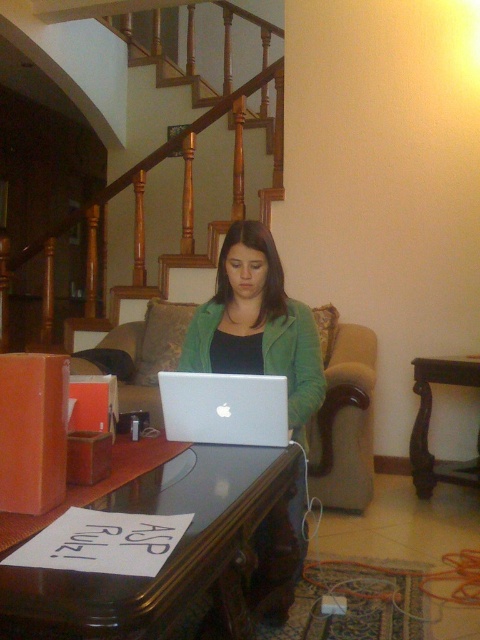
Image resolution: width=480 pixels, height=640 pixels. In order to click on black glossy table at lower center in this screenshot , I will do `click(168, 556)`.

Does black glossy table at lower center have a larger size compared to silver metallic laptop at center?

Indeed, black glossy table at lower center has a larger size compared to silver metallic laptop at center.

Between point (57, 616) and point (166, 392), which one is positioned behind?

Point (166, 392)

Find the location of a particular element. black glossy table at lower center is located at coordinates (168, 556).

Does matte green jacket at center have a lesser width compared to beige fabric couch at center?

Indeed, matte green jacket at center has a lesser width compared to beige fabric couch at center.

Which is more to the right, matte green jacket at center or beige fabric couch at center?

Positioned to the right is matte green jacket at center.

Is point (294, 532) positioned before point (182, 314)?

Yes.

What are the coordinates of `matte green jacket at center` in the screenshot? It's located at (257, 324).

Looking at this image, can you confirm if silver metallic laptop at center is positioned above brown wood table at lower right?

Yes.

Who is more forward, (x=201, y=396) or (x=425, y=451)?

Point (x=201, y=396)

Find the location of a particular element. This screenshot has height=640, width=480. silver metallic laptop at center is located at coordinates (225, 408).